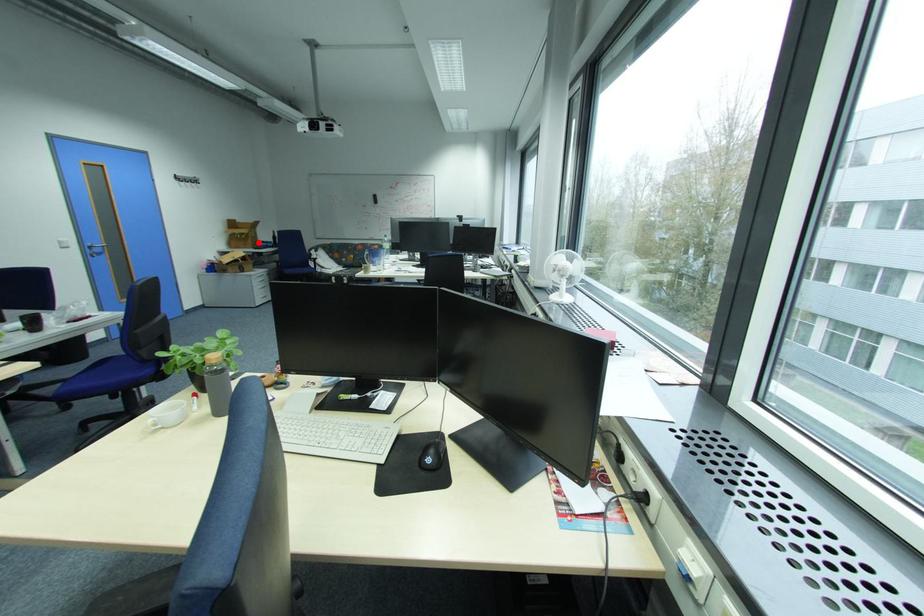
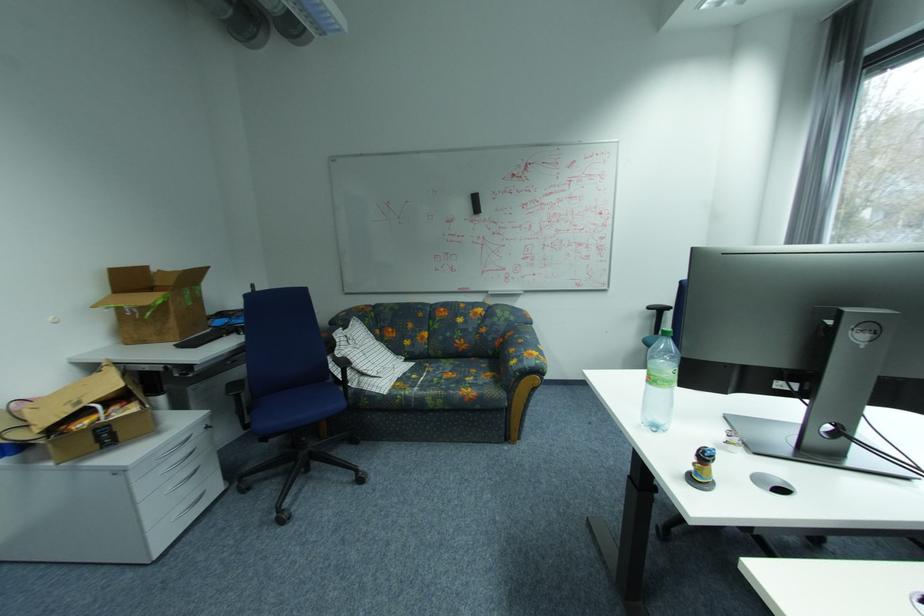
The point at the highlighted location is marked in the first image. Where is the corresponding point in the second image?

(180, 323)